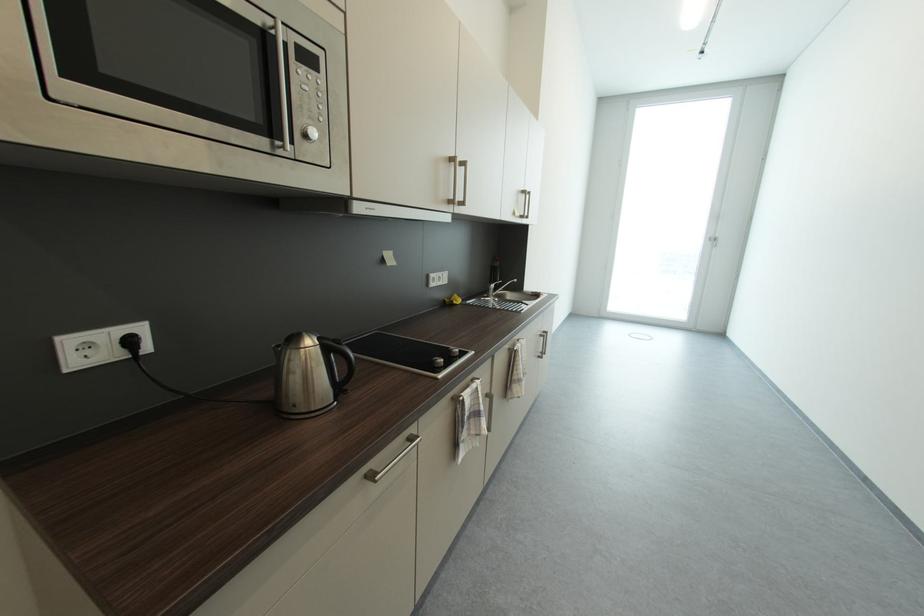
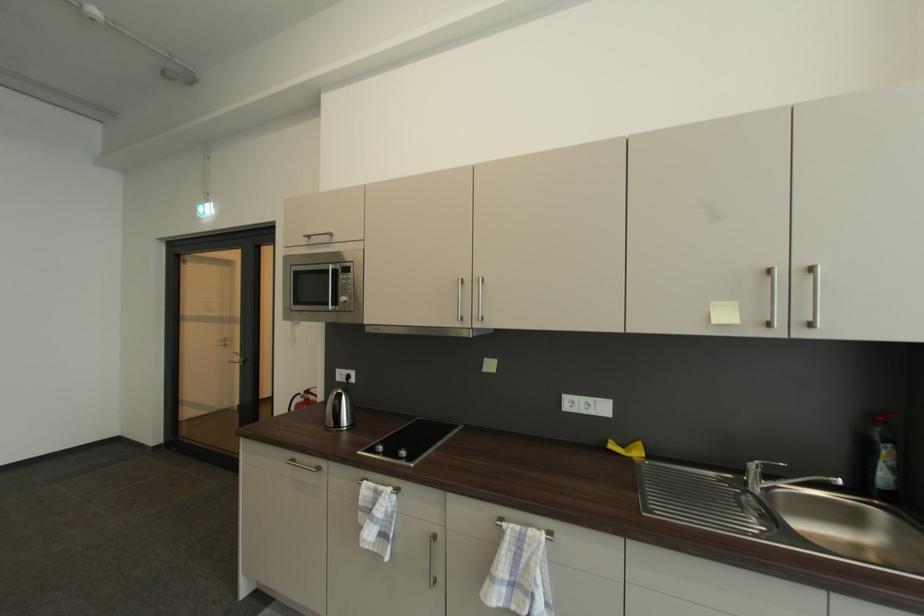
Locate, in the second image, the point that corresponds to (523,351) in the first image.

(507, 529)